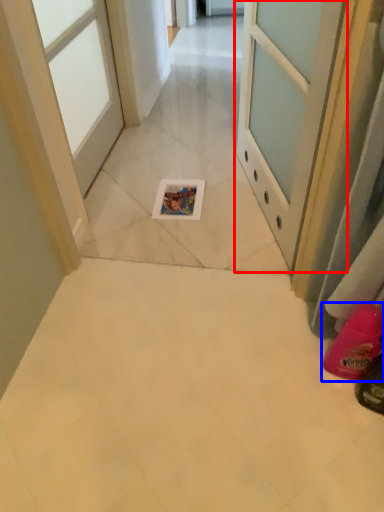
Question: Among these objects, which one is nearest to the camera, door (highlighted by a red box) or footwear (highlighted by a blue box)?

Choices:
 (A) door
 (B) footwear

Answer: (A)